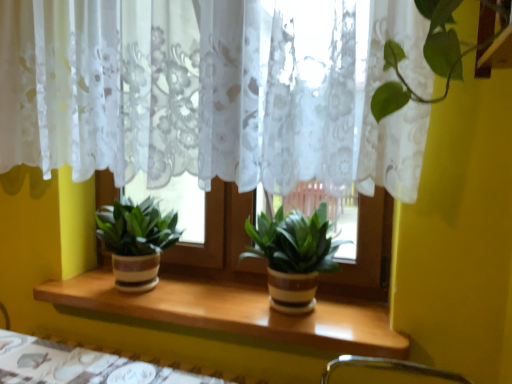
Locate an element on the screen. This screenshot has width=512, height=384. vacant area that is situated to the right of green matte plant at center, the 2th houseplant viewed from the right is located at coordinates (204, 297).